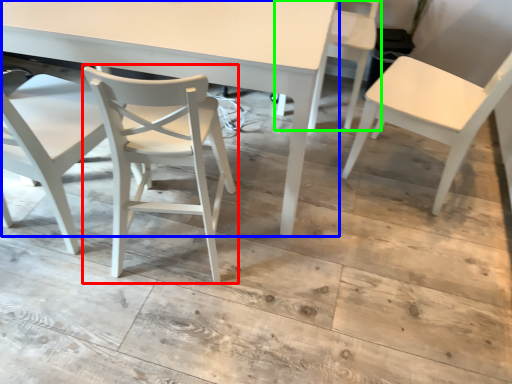
Question: Based on their relative distances, which object is farther from chair (highlighted by a red box)? Choose from table (highlighted by a blue box) and chair (highlighted by a green box).

Choices:
 (A) table
 (B) chair

Answer: (B)